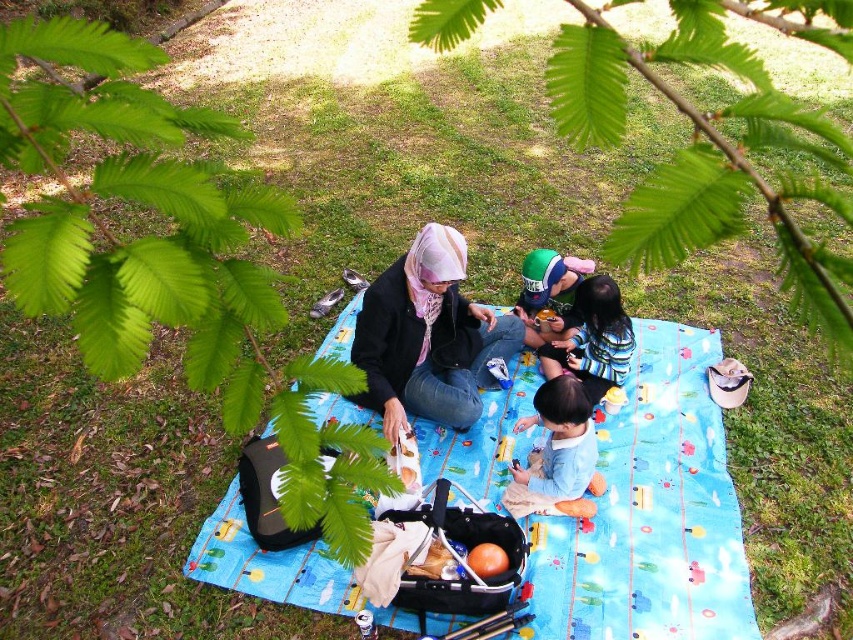
Question: Estimate the real-world distances between objects in this image. Which object is farther from the striped fabric shirt at center?

Choices:
 (A) green leafy branch at upper center
 (B) green knit cap at center
 (C) light blue fabric at center

Answer: (A)

Question: Which of these objects is positioned closest to the green leafy branch at upper left?

Choices:
 (A) light blue fabric at center
 (B) blue fabric picnic blanket at center
 (C) striped fabric shirt at center
 (D) green knit cap at center

Answer: (A)

Question: Is blue fabric picnic blanket at center thinner than striped fabric shirt at center?

Choices:
 (A) yes
 (B) no

Answer: (B)

Question: Is green leafy branch at upper left closer to camera compared to light blue fabric at center?

Choices:
 (A) yes
 (B) no

Answer: (A)

Question: Is green leafy branch at upper center bigger than green knit cap at center?

Choices:
 (A) yes
 (B) no

Answer: (A)

Question: Which point appears closest to the camera in this image?

Choices:
 (A) (630, 380)
 (B) (564, 324)
 (C) (695, 243)
 (D) (590, 388)

Answer: (C)